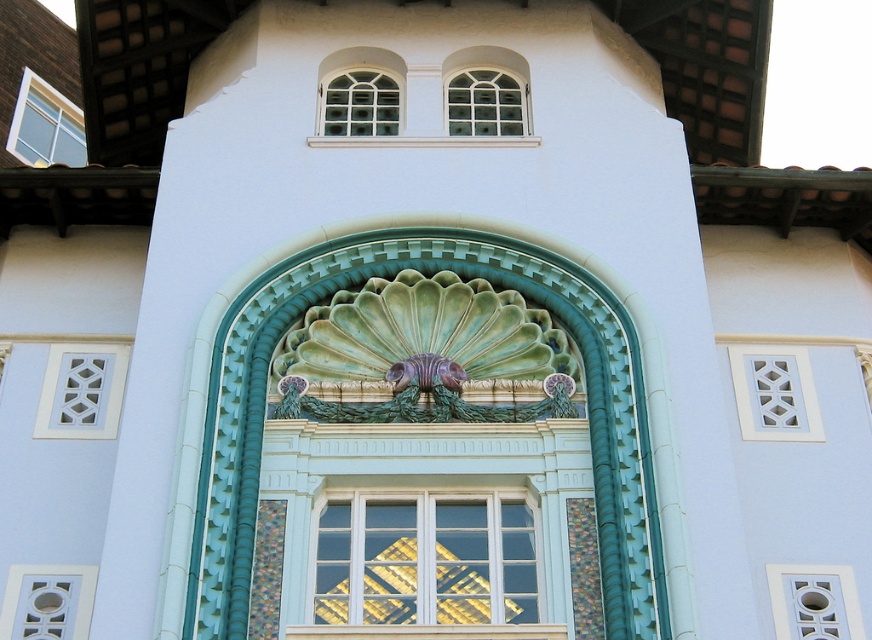
Question: Is white glass window at center to the left of white lattice at upper left from the viewer's perspective?

Choices:
 (A) yes
 (B) no

Answer: (B)

Question: Which point is farther to the camera?

Choices:
 (A) white lattice at center
 (B) green ceramic scallop shell at center

Answer: (A)

Question: Which point is closer to the camera taking this photo?

Choices:
 (A) pyautogui.click(x=855, y=624)
 (B) pyautogui.click(x=519, y=548)
 (C) pyautogui.click(x=782, y=408)

Answer: (B)

Question: Which point is closer to the camera?

Choices:
 (A) (486, 596)
 (B) (513, 116)
 (C) (80, 157)
 (D) (109, 406)

Answer: (A)

Question: Can you confirm if white glass window at center is positioned below matte glass window at upper left?

Choices:
 (A) yes
 (B) no

Answer: (A)

Question: Considering the relative positions of white glass window at center and white lattice at lower right in the image provided, where is white glass window at center located with respect to white lattice at lower right?

Choices:
 (A) right
 (B) left

Answer: (B)